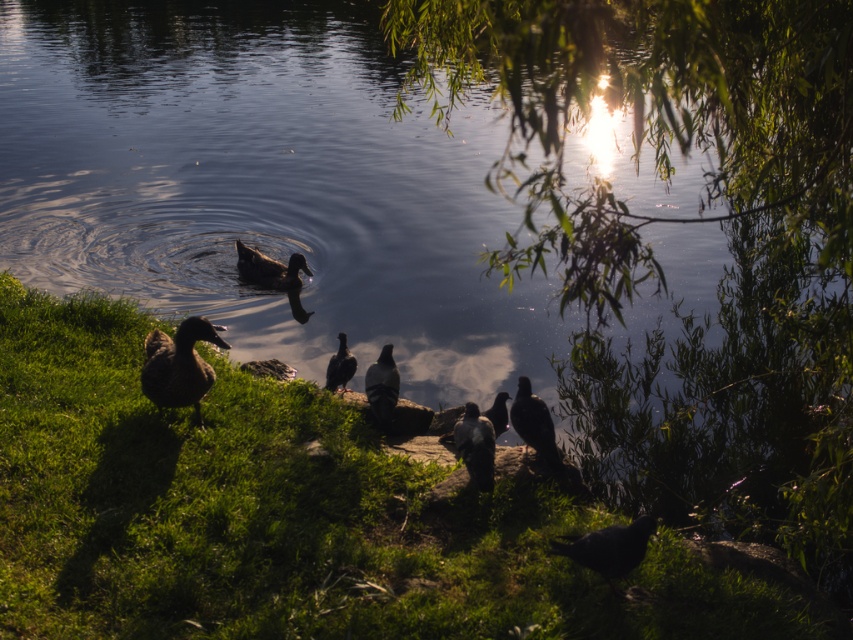
Question: Does green grass at lower left have a lesser width compared to silhouette feathered bird at center?

Choices:
 (A) no
 (B) yes

Answer: (A)

Question: Can you confirm if dark gray feathers at center is bigger than gray matte pigeon at center?

Choices:
 (A) no
 (B) yes

Answer: (B)

Question: Which point is farther to the camera?

Choices:
 (A) gray matte pigeon at center
 (B) silhouette feathered bird at center
 (C) dark brown feathers at center
 (D) green grass at lower left

Answer: (C)

Question: Can you confirm if shiny black bird at lower right is smaller than gray matte pigeon at center?

Choices:
 (A) yes
 (B) no

Answer: (B)

Question: Among these points, which one is nearest to the camera?

Choices:
 (A) (503, 406)
 (B) (160, 358)
 (C) (550, 422)

Answer: (B)

Question: Which is nearer to the silvery metallic pigeon at center?

Choices:
 (A) green grass at lower left
 (B) silhouette feathered bird at center
 (C) dark brown feathers at center
 (D) shiny black bird at lower right

Answer: (B)